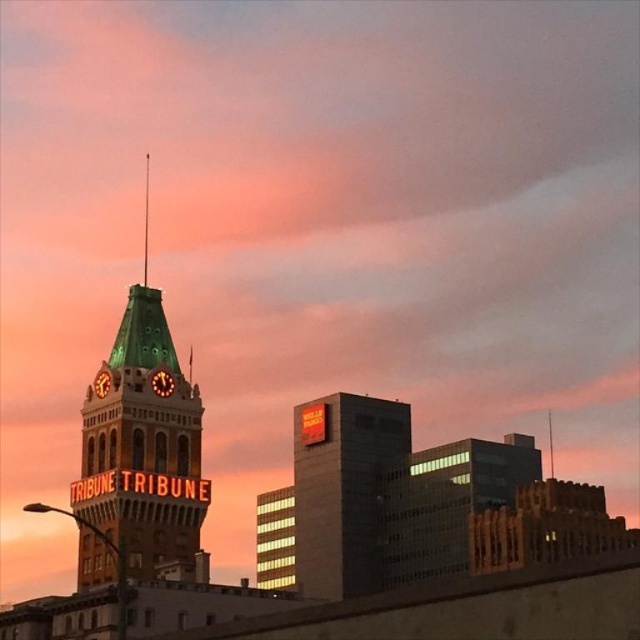
Question: Which is farther from the matte orange sign at center?

Choices:
 (A) matte green clock tower at upper left
 (B) green copper clock tower at upper left
 (C) orange metallic clock at center

Answer: (A)

Question: Can you confirm if orange metallic clock at center is bigger than matte green clock tower at upper left?

Choices:
 (A) yes
 (B) no

Answer: (A)

Question: Which object is positioned closest to the matte green clock tower at upper left?

Choices:
 (A) orange metallic clock at center
 (B) matte orange sign at center

Answer: (A)

Question: Does green copper clock tower at upper left have a smaller size compared to orange metallic clock at center?

Choices:
 (A) no
 (B) yes

Answer: (A)

Question: Which point is closer to the camera taking this photo?

Choices:
 (A) (150, 378)
 (B) (156, 500)
 (C) (100, 376)

Answer: (B)

Question: Can you confirm if green copper clock tower at upper left is positioned to the left of orange metallic clock at center?

Choices:
 (A) no
 (B) yes

Answer: (B)